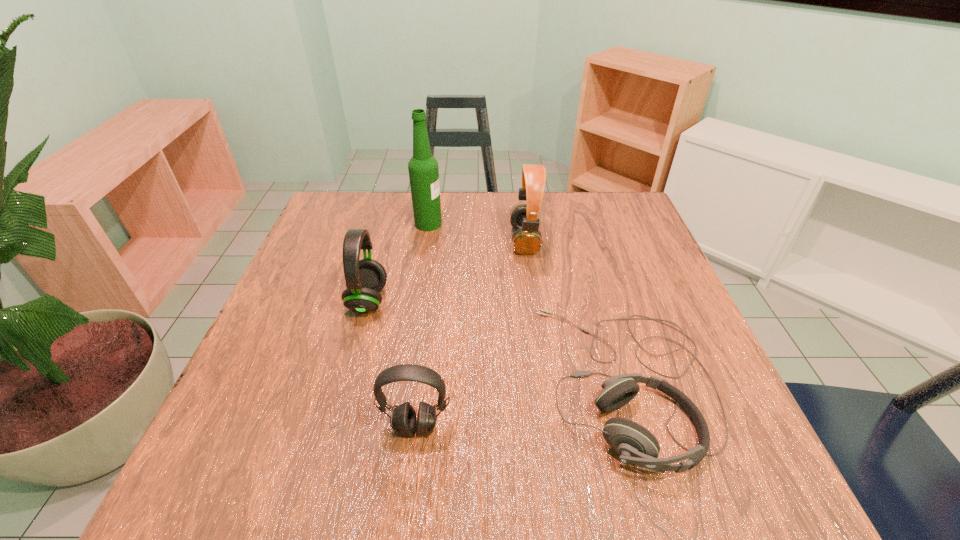
In the image, there is a desktop. Identify the location of vacant space at the near edge. (370, 466).

At what (x,y) coordinates should I click in order to perform the action: click on free space at the left edge of the desktop. Please return your answer as a coordinate pair (x, y). This screenshot has height=540, width=960. Looking at the image, I should click on (267, 423).

In the image, there is a desktop. Find the location of `vacant space at the right edge`. vacant space at the right edge is located at coordinates (633, 260).

This screenshot has width=960, height=540. In the image, there is a desktop. Find the location of `vacant space at the far left corner`. vacant space at the far left corner is located at coordinates (332, 232).

Where is `vacant region at the far right corner of the desktop`? vacant region at the far right corner of the desktop is located at coordinates (624, 191).

I want to click on free space between the shortest headset and the leftmost object, so click(498, 342).

Locate an element on the screen. free space between the shortest headset and the leftmost headset is located at coordinates (498, 342).

In order to click on vacant area between the beer bottle and the shortest object in this screenshot , I will do `click(529, 303)`.

Where is `free space between the beer bottle and the farthest headset`? The image size is (960, 540). free space between the beer bottle and the farthest headset is located at coordinates (476, 232).

What are the coordinates of `vacant point located between the tallest object and the leftmost object` in the screenshot? It's located at (398, 262).